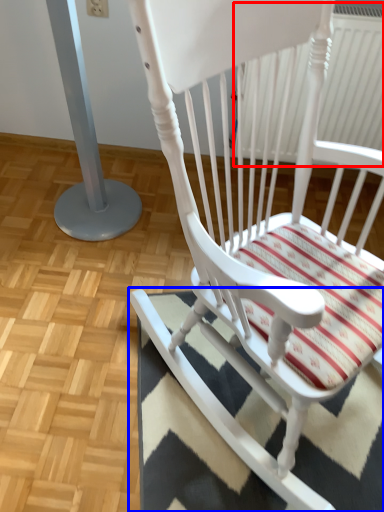
Question: Which of the following is the closest to the observer, radiator (highlighted by a red box) or doormat (highlighted by a blue box)?

Choices:
 (A) radiator
 (B) doormat

Answer: (B)